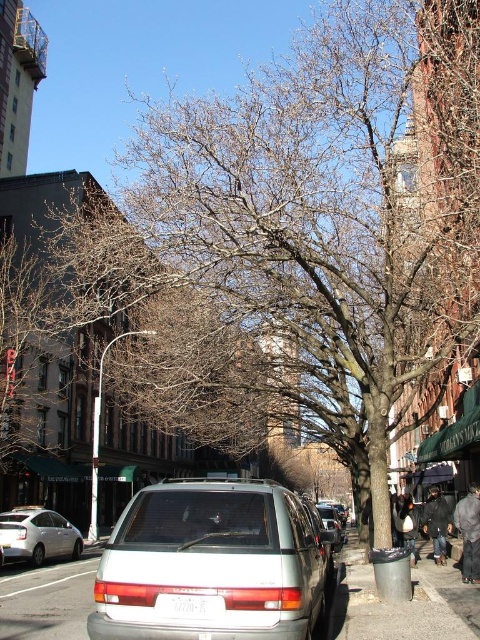
You are a delivery person standing on the gray asphalt pavement at lower center and need to hand a package to someone wearing the dark gray fabric coat at lower right. Can you reach them without moving from your current position?

The gray asphalt pavement at lower center is below the dark gray fabric coat at lower right, meaning the coat is elevated. Since you are on the pavement below, you would need to move closer or have the recipient come down to receive the package.

Looking at this image, you are a delivery person who needs to deliver a package to the matte silver van at center. However, there is a dark gray fabric coat at lower right in your way. Can you walk around it to reach the van?

The dark gray fabric coat at lower right has a smaller size compared to matte silver van at center, so yes, you can walk around it to reach the matte silver van at center since it is smaller in size.